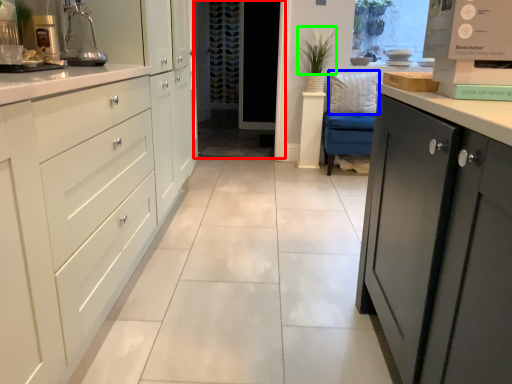
Question: Estimate the real-world distances between objects in this image. Which object is closer to screen door (highlighted by a red box), pillow (highlighted by a blue box) or plant (highlighted by a green box)?

Choices:
 (A) pillow
 (B) plant

Answer: (B)